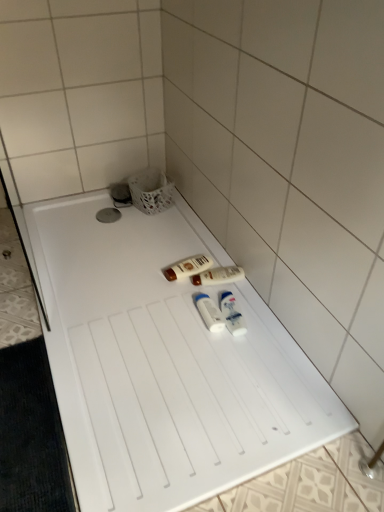
Question: Based on their positions, is white plastic bottles at center, the fourth toiletry positioned from the back, located to the left or right of white glossy lotion at center, the third toiletry from the front?

Choices:
 (A) right
 (B) left

Answer: (A)

Question: Which is correct: white plastic bottles at center, the 1th toiletry from the front, is inside white glossy lotion at center, acting as the second toiletry starting from the back, or outside of it?

Choices:
 (A) inside
 (B) outside

Answer: (B)

Question: Estimate the real-world distances between objects in this image. Which object is farther from the white plastic tubes at center, placed as the 3th toiletry when sorted from back to front?

Choices:
 (A) white plastic bottles at center, the 1th toiletry from the front
 (B) white plastic tray at center
 (C) matte brown lotion at center, which is counted as the 4th toiletry, starting from the front
 (D) white glossy lotion at center, the third toiletry from the front

Answer: (B)

Question: Which is nearer to the white plastic tray at center?

Choices:
 (A) white plastic bottles at center, the 1th toiletry from the front
 (B) matte brown lotion at center, which is counted as the 4th toiletry, starting from the front
 (C) white glossy lotion at center, acting as the second toiletry starting from the back
 (D) white plastic tubes at center, placed as the 3th toiletry when sorted from back to front

Answer: (D)